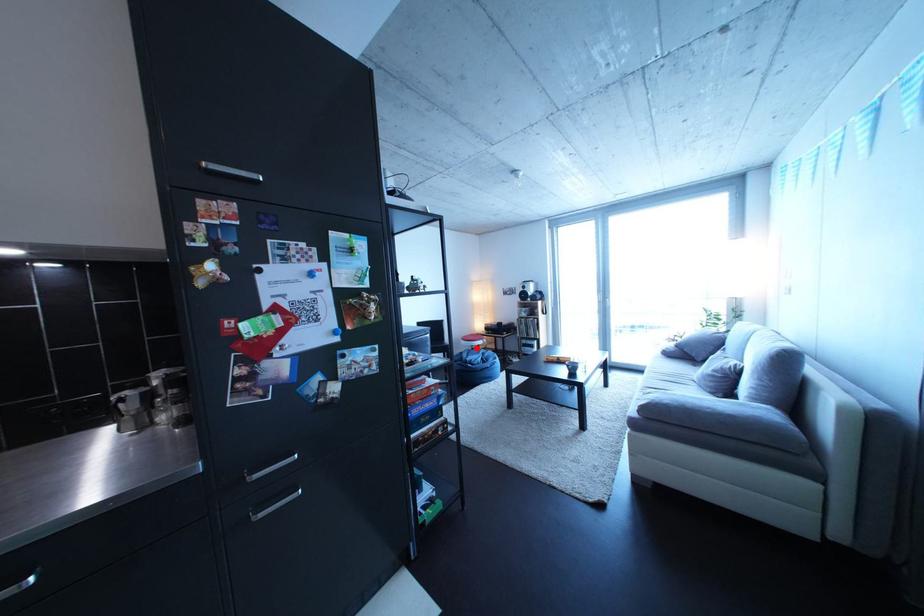
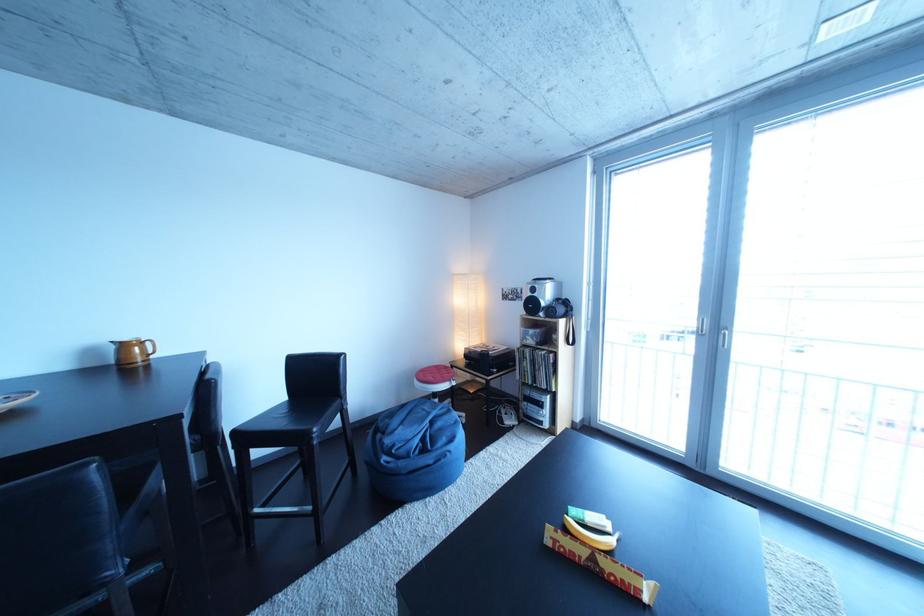
In the second image, find the point that corresponds to the highlighted location in the first image.

(430, 387)